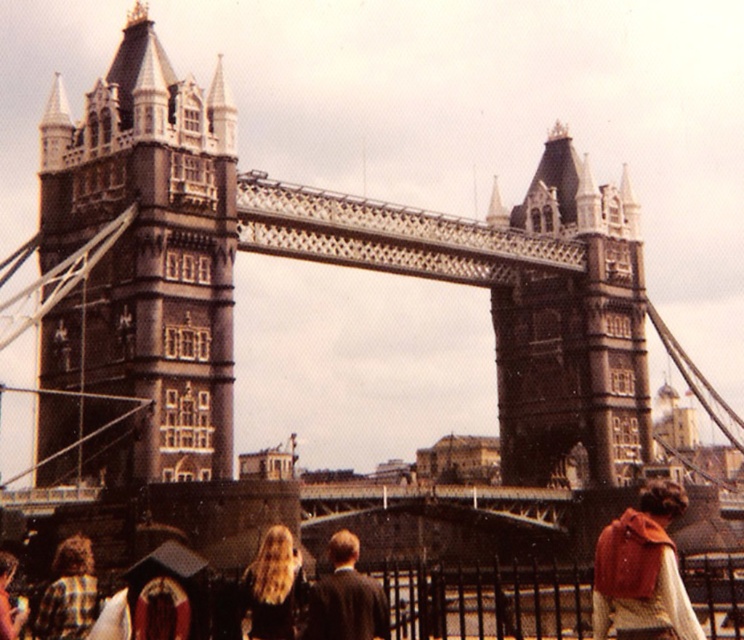
You are a photographer planning to take a photo of the Tower Bridge with both the dark brown suit at center and the plaid shirt at lower left in the frame. Based on their positions, which object should you focus on first to ensure both are in focus?

The dark brown suit at center is closer to the viewer than the plaid shirt at lower left, so you should focus on the dark brown suit at center first to ensure both are in focus.

You are a photographer trying to capture a photo of the dark gray stone tower at center and the dark brown suit at center in the same frame. Based on their sizes in the image, which object would appear larger in your photo?

The dark gray stone tower at center would appear larger in the photo because it is taller than the dark brown suit at center.